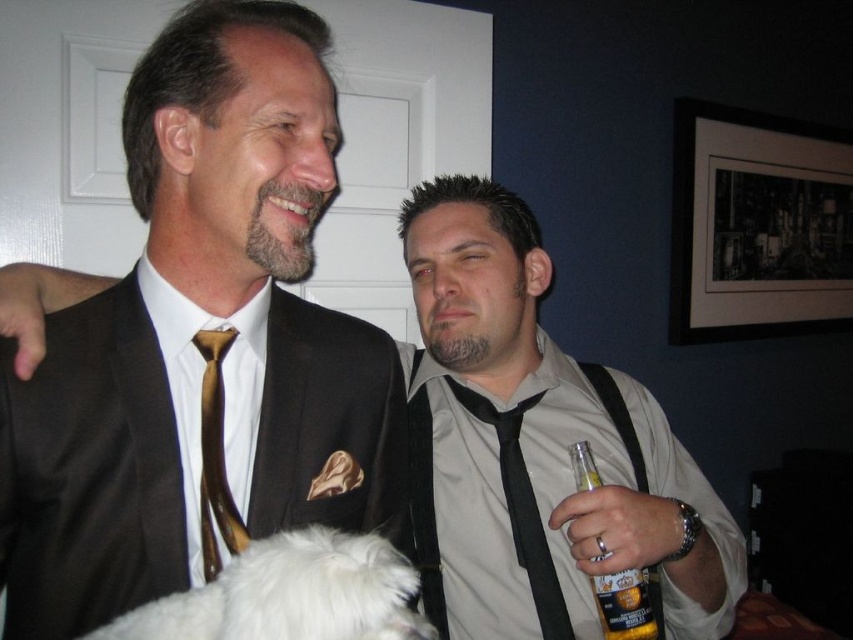
Is black satin tie at center positioned in front of gold silk tie at center?

No, it is not.

Between point (543, 572) and point (213, 346), which one is positioned in front?

Positioned in front is point (213, 346).

Identify the location of black satin tie at center. This screenshot has width=853, height=640. (521, 508).

The width and height of the screenshot is (853, 640). I want to click on black satin tie at center, so click(x=521, y=508).

Does point (358, 620) come in front of point (204, 515)?

Yes, it is in front of point (204, 515).

Which is in front, point (326, 584) or point (216, 444)?

Positioned in front is point (326, 584).

Locate an element on the screen. white fluffy dog at lower left is located at coordinates (291, 595).

The image size is (853, 640). What do you see at coordinates (521, 508) in the screenshot?
I see `black satin tie at center` at bounding box center [521, 508].

Is black satin tie at center positioned in front of translucent glass beer bottle at right?

No, it is not.

Who is more forward, (527, 552) or (654, 637)?

Point (654, 637) is in front.

This screenshot has height=640, width=853. Identify the location of black satin tie at center. point(521,508).